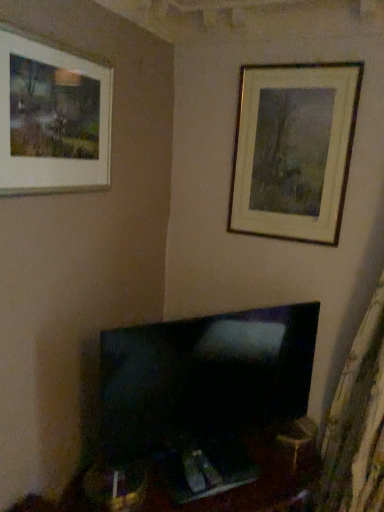
What is the approximate height of gold metallic picture frame at upper right, the 2th picture frame from the left?

gold metallic picture frame at upper right, the 2th picture frame from the left, is 29.04 inches tall.

What is the approximate width of matte white picture frame at upper left, positioned as the 1th picture frame in front-to-back order?

1.96 inches.

Locate an element on the screen. The image size is (384, 512). gold metallic picture frame at upper right, the 2th picture frame from the left is located at coordinates (294, 150).

Can you confirm if black glossy tv at center is bigger than gold metallic picture frame at upper right, which is the second picture frame in front-to-back order?

Correct, black glossy tv at center is larger in size than gold metallic picture frame at upper right, which is the second picture frame in front-to-back order.

Which is more to the right, black glossy tv at center or gold metallic picture frame at upper right, which ranks as the 1th picture frame in right-to-left order?

Positioned to the right is gold metallic picture frame at upper right, which ranks as the 1th picture frame in right-to-left order.

Looking at this image, is black glossy tv at center not within gold metallic picture frame at upper right, marked as the first picture frame in a back-to-front arrangement?

black glossy tv at center is positioned outside gold metallic picture frame at upper right, marked as the first picture frame in a back-to-front arrangement.

Is gold metallic picture frame at upper right, the 2th picture frame from the left, next to matte white picture frame at upper left, which is the second picture frame in right-to-left order?

No, gold metallic picture frame at upper right, the 2th picture frame from the left, is not with matte white picture frame at upper left, which is the second picture frame in right-to-left order.

Considering the positions of objects gold metallic picture frame at upper right, which ranks as the 1th picture frame in right-to-left order, and matte white picture frame at upper left, placed as the second picture frame when sorted from back to front, in the image provided, who is more to the left, gold metallic picture frame at upper right, which ranks as the 1th picture frame in right-to-left order, or matte white picture frame at upper left, placed as the second picture frame when sorted from back to front,?

matte white picture frame at upper left, placed as the second picture frame when sorted from back to front.

Consider the image. Considering the relative sizes of gold metallic picture frame at upper right, which ranks as the 1th picture frame in right-to-left order, and matte white picture frame at upper left, which is the second picture frame in right-to-left order, in the image provided, is gold metallic picture frame at upper right, which ranks as the 1th picture frame in right-to-left order, wider than matte white picture frame at upper left, which is the second picture frame in right-to-left order,?

In fact, gold metallic picture frame at upper right, which ranks as the 1th picture frame in right-to-left order, might be narrower than matte white picture frame at upper left, which is the second picture frame in right-to-left order.

Are matte white picture frame at upper left, which is the second picture frame in right-to-left order, and gold metallic picture frame at upper right, the 2th picture frame from the left, beside each other?

They are not placed beside each other.

From a real-world perspective, which is physically above, matte white picture frame at upper left, positioned as the 1th picture frame in front-to-back order, or gold metallic picture frame at upper right, which is the second picture frame in front-to-back order?

matte white picture frame at upper left, positioned as the 1th picture frame in front-to-back order, is physically above.

Which of these two, matte white picture frame at upper left, which ranks as the 1th picture frame in left-to-right order, or gold metallic picture frame at upper right, which ranks as the 1th picture frame in right-to-left order, stands shorter?

matte white picture frame at upper left, which ranks as the 1th picture frame in left-to-right order, is shorter.

The image size is (384, 512). Identify the location of television below the matte white picture frame at upper left, which is the second picture frame in right-to-left order (from the image's perspective). (203, 377).

Which is correct: black glossy tv at center is inside matte white picture frame at upper left, positioned as the 1th picture frame in front-to-back order, or outside of it?

black glossy tv at center is outside matte white picture frame at upper left, positioned as the 1th picture frame in front-to-back order.

In the image, is black glossy tv at center positioned in front of or behind matte white picture frame at upper left, placed as the second picture frame when sorted from back to front?

Visually, black glossy tv at center is located behind matte white picture frame at upper left, placed as the second picture frame when sorted from back to front.

From the image's perspective, is black glossy tv at center above matte white picture frame at upper left, which is the second picture frame in right-to-left order?

Actually, black glossy tv at center appears below matte white picture frame at upper left, which is the second picture frame in right-to-left order, in the image.

Which is more to the left, gold metallic picture frame at upper right, which is the second picture frame in front-to-back order, or black glossy tv at center?

From the viewer's perspective, black glossy tv at center appears more on the left side.

From a real-world perspective, is gold metallic picture frame at upper right, which ranks as the 1th picture frame in right-to-left order, physically above black glossy tv at center?

Correct, in the physical world, gold metallic picture frame at upper right, which ranks as the 1th picture frame in right-to-left order, is higher than black glossy tv at center.

Could you tell me if gold metallic picture frame at upper right, marked as the first picture frame in a back-to-front arrangement, is turned towards black glossy tv at center?

No, gold metallic picture frame at upper right, marked as the first picture frame in a back-to-front arrangement, does not turn towards black glossy tv at center.

Which is closer, (336, 68) or (253, 396)?

Clearly, point (336, 68) is closer to the camera than point (253, 396).

Is matte white picture frame at upper left, which is the second picture frame in right-to-left order, not close to black glossy tv at center?

Actually, matte white picture frame at upper left, which is the second picture frame in right-to-left order, and black glossy tv at center are a little close together.

How far apart are matte white picture frame at upper left, positioned as the 1th picture frame in front-to-back order, and black glossy tv at center?

32.63 inches.

Is matte white picture frame at upper left, positioned as the 1th picture frame in front-to-back order, inside the boundaries of black glossy tv at center, or outside?

matte white picture frame at upper left, positioned as the 1th picture frame in front-to-back order, lies outside black glossy tv at center.

Looking at their sizes, would you say matte white picture frame at upper left, placed as the second picture frame when sorted from back to front, is wider or thinner than black glossy tv at center?

Considering their sizes, matte white picture frame at upper left, placed as the second picture frame when sorted from back to front, looks slimmer than black glossy tv at center.

You are a GUI agent. You are given a task and a screenshot of the screen. Output one action in this format:
    pyautogui.click(x=<x>, y=<y>)
    Task: Click on the picture frame that is on the right side of black glossy tv at center
    Image resolution: width=384 pixels, height=512 pixels.
    Given the screenshot: What is the action you would take?
    pyautogui.click(x=294, y=150)

This screenshot has width=384, height=512. I want to click on picture frame on the left of gold metallic picture frame at upper right, which ranks as the 1th picture frame in right-to-left order, so click(52, 119).

Looking at the image, which one is located further to matte white picture frame at upper left, positioned as the 1th picture frame in front-to-back order, gold metallic picture frame at upper right, which is the second picture frame in front-to-back order, or black glossy tv at center?

black glossy tv at center lies further to matte white picture frame at upper left, positioned as the 1th picture frame in front-to-back order, than the other object.

From the image, which object appears to be nearer to black glossy tv at center, matte white picture frame at upper left, which is the second picture frame in right-to-left order, or gold metallic picture frame at upper right, marked as the first picture frame in a back-to-front arrangement?

The object closer to black glossy tv at center is gold metallic picture frame at upper right, marked as the first picture frame in a back-to-front arrangement.

Looking at the image, which one is located further to black glossy tv at center, gold metallic picture frame at upper right, marked as the first picture frame in a back-to-front arrangement, or matte white picture frame at upper left, which is the second picture frame in right-to-left order?

matte white picture frame at upper left, which is the second picture frame in right-to-left order, lies further to black glossy tv at center than the other object.

From the picture: Looking at the image, which one is located closer to matte white picture frame at upper left, placed as the second picture frame when sorted from back to front, black glossy tv at center or gold metallic picture frame at upper right, which ranks as the 1th picture frame in right-to-left order?

gold metallic picture frame at upper right, which ranks as the 1th picture frame in right-to-left order.

Considering their positions, is black glossy tv at center positioned closer to gold metallic picture frame at upper right, which is the second picture frame in front-to-back order, than matte white picture frame at upper left, placed as the second picture frame when sorted from back to front?

black glossy tv at center.

Based on their spatial positions, is matte white picture frame at upper left, positioned as the 1th picture frame in front-to-back order, or black glossy tv at center further from gold metallic picture frame at upper right, which ranks as the 1th picture frame in right-to-left order?

matte white picture frame at upper left, positioned as the 1th picture frame in front-to-back order, lies further to gold metallic picture frame at upper right, which ranks as the 1th picture frame in right-to-left order, than the other object.

The width and height of the screenshot is (384, 512). In order to click on picture frame between gold metallic picture frame at upper right, which is the second picture frame in front-to-back order, and black glossy tv at center in the up-down direction in this screenshot , I will do `click(52, 119)`.